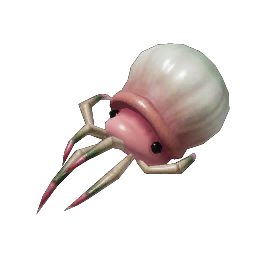
This screenshot has height=256, width=256. Identify the location of leftmost leg. point(91,98).